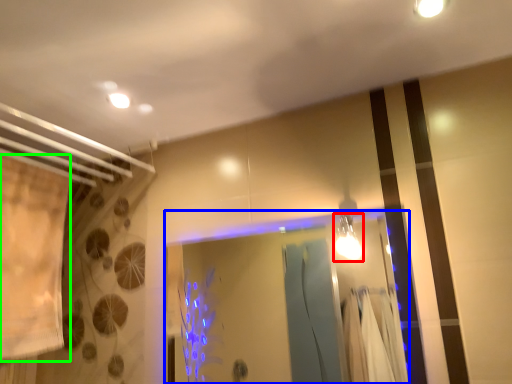
Question: Based on their relative distances, which object is farther from light fixture (highlighted by a red box)? Choose from glass door (highlighted by a blue box) and shower curtain (highlighted by a green box).

Choices:
 (A) glass door
 (B) shower curtain

Answer: (B)